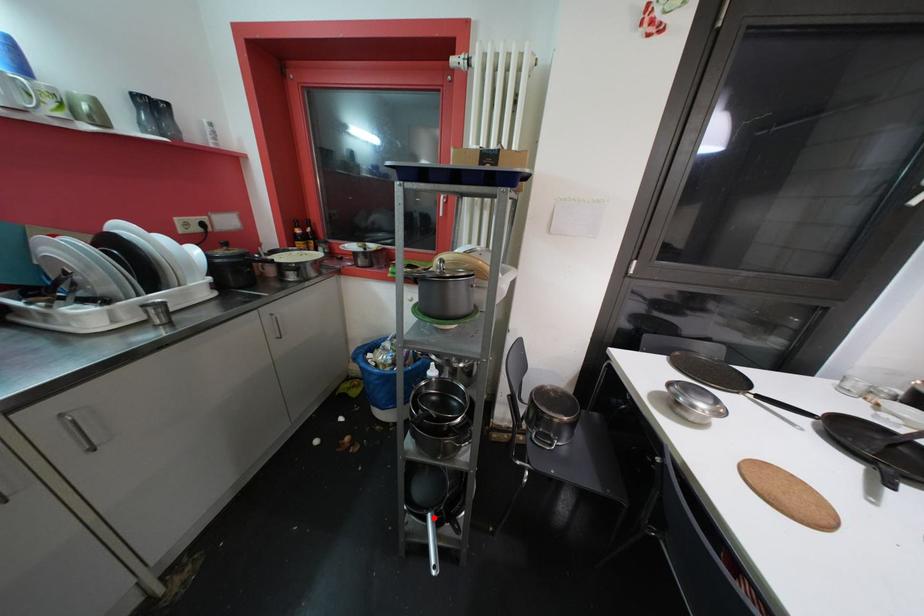
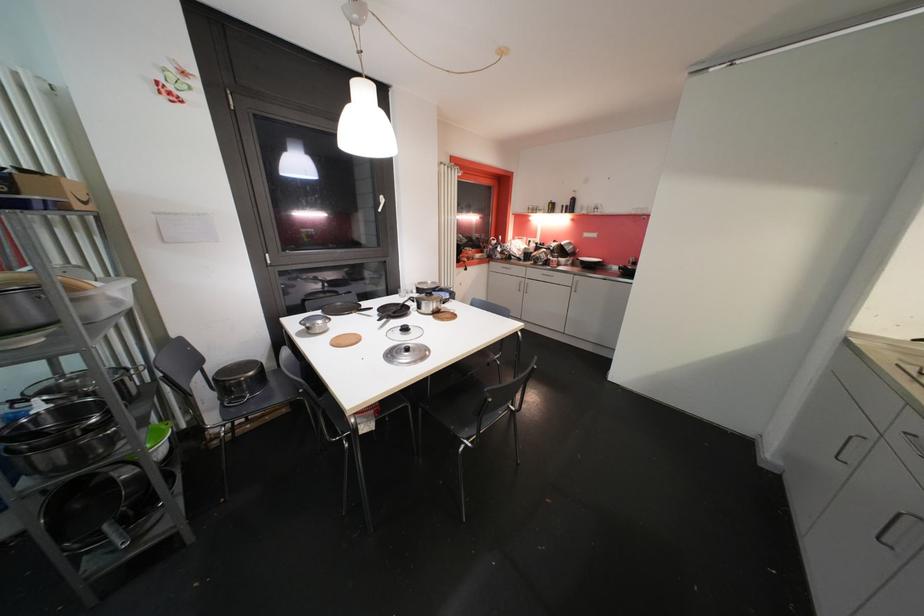
Locate, in the second image, the point that corresponds to the highlighted location in the first image.

(111, 529)